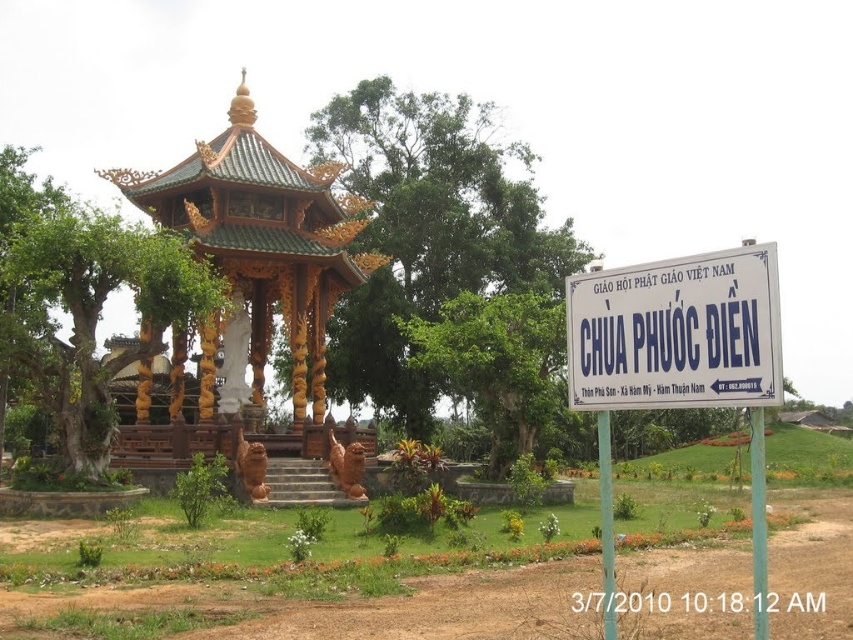
Between golden wood gazebo at center and white plastic sign at center, which one is positioned higher?

Positioned higher is golden wood gazebo at center.

Who is more forward, (224, 451) or (741, 362)?

Point (741, 362) is more forward.

Locate an element on the screen. golden wood gazebo at center is located at coordinates (250, 282).

In the scene shown: Can you confirm if white plastic sign at right is taller than white plastic sign at center?

Indeed, white plastic sign at right has a greater height compared to white plastic sign at center.

Can you confirm if white plastic sign at right is shorter than white plastic sign at center?

Incorrect, white plastic sign at right's height does not fall short of white plastic sign at center's.

Does point (775, 285) come farther from viewer compared to point (643, 346)?

No, it is in front of (643, 346).

This screenshot has height=640, width=853. I want to click on white plastic sign at right, so click(x=677, y=362).

Which is above, golden wood gazebo at center or white plastic sign at right?

golden wood gazebo at center

Which is behind, point (254, 138) or point (648, 358)?

Positioned behind is point (254, 138).

I want to click on golden wood gazebo at center, so click(x=250, y=282).